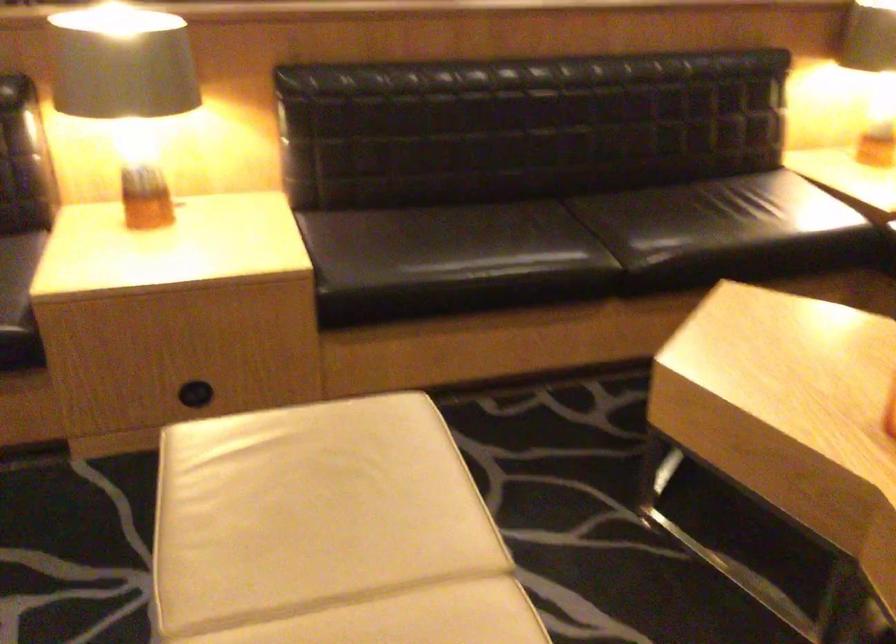
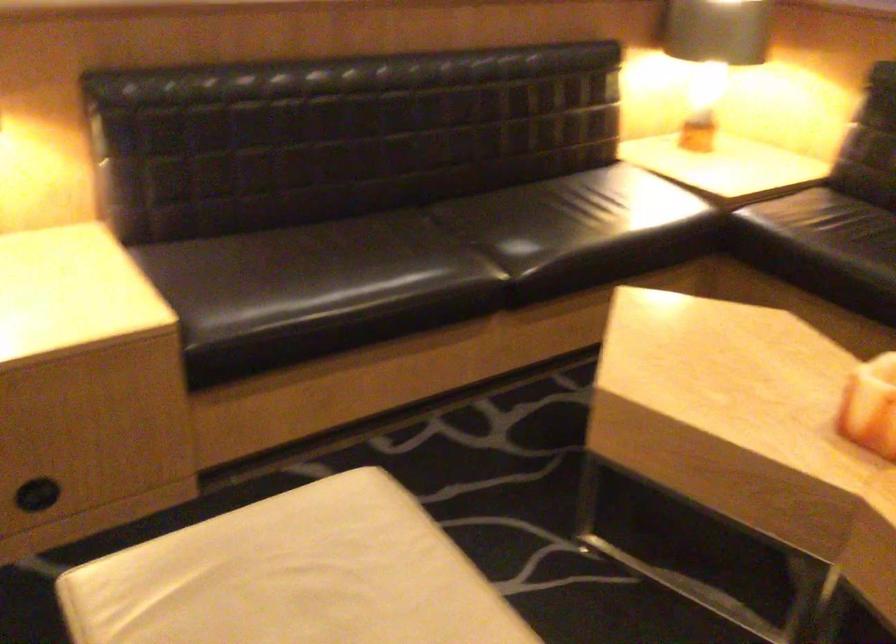
Question: Based on the continuous images, in which direction is the camera rotating? Reply with the corresponding letter.

Choices:
 (A) Left
 (B) Right
 (C) Up
 (D) Down

Answer: (B)